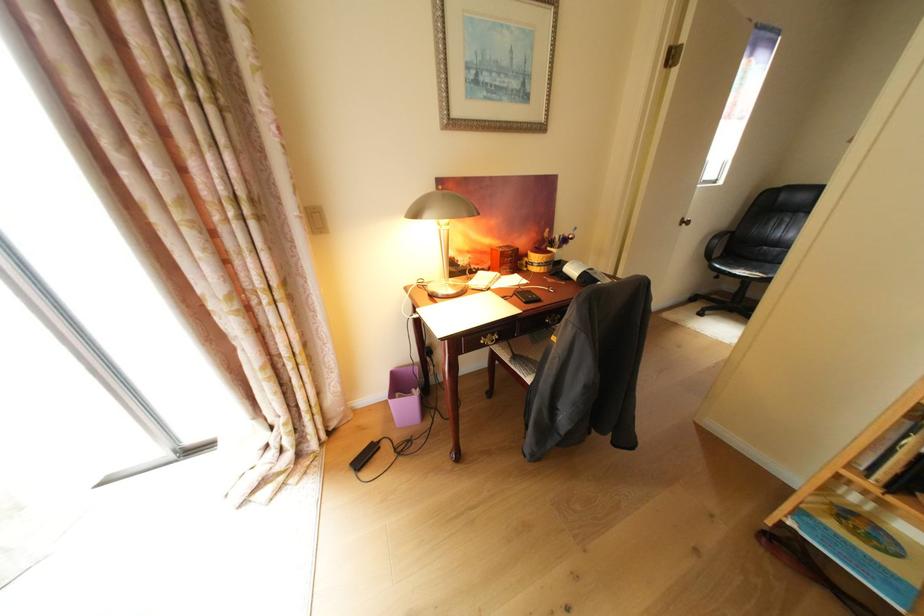
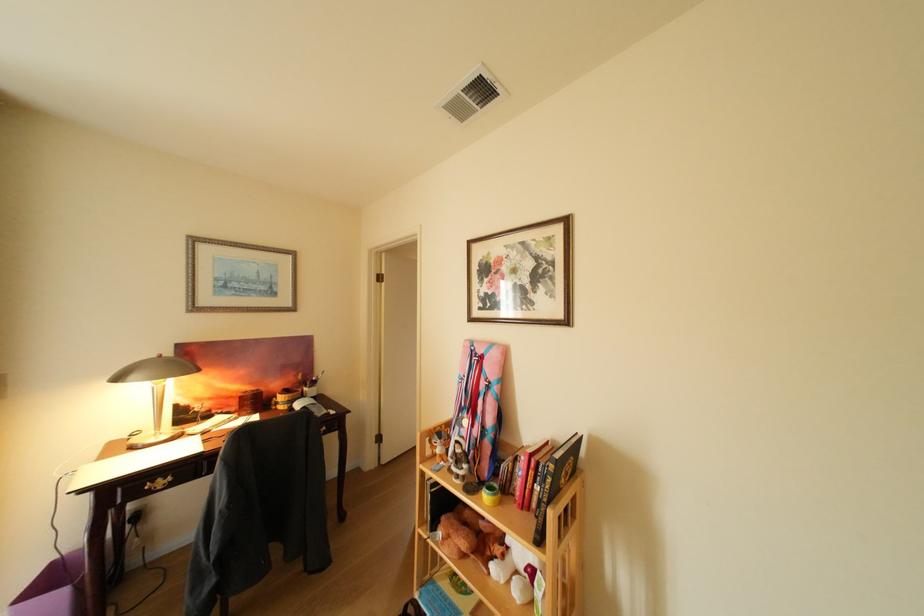
Find the pixel in the second image that matches the point at 561,232 in the first image.

(313, 376)